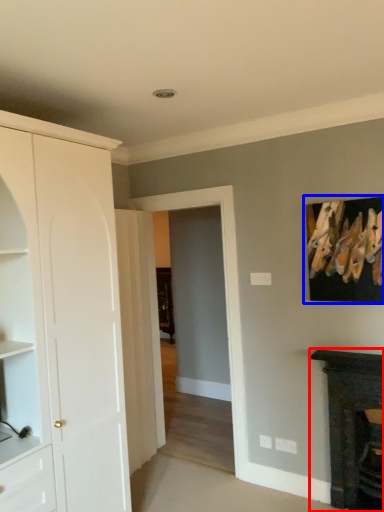
Question: Among these objects, which one is farthest to the camera, fireplace (highlighted by a red box) or picture frame (highlighted by a blue box)?

Choices:
 (A) fireplace
 (B) picture frame

Answer: (B)